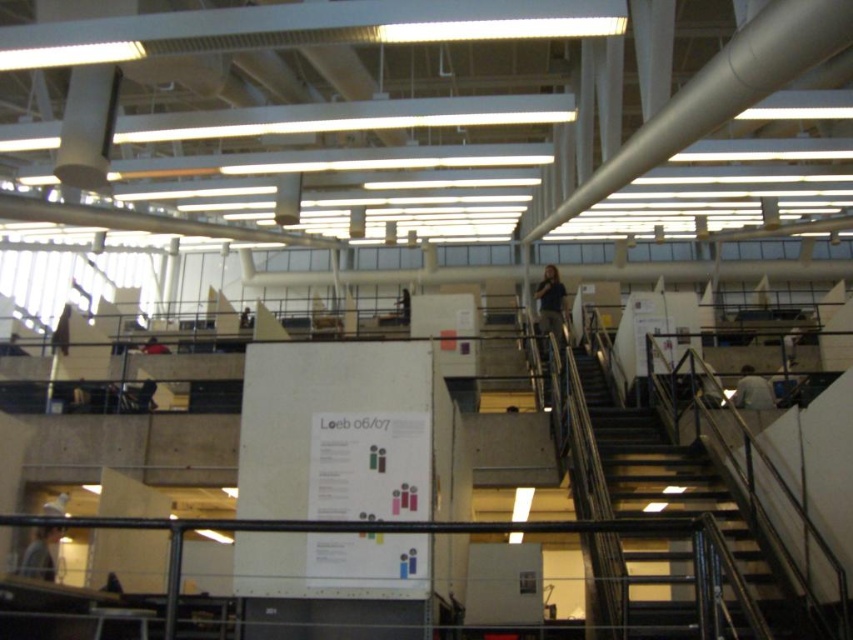
Which is more to the right, dark brown leather jacket at upper center or light brown fabric shirt at lower right?

Positioned to the right is light brown fabric shirt at lower right.

Is point (540, 310) closer to viewer compared to point (735, 385)?

No, (540, 310) is behind (735, 385).

You are a GUI agent. You are given a task and a screenshot of the screen. Output one action in this format:
    pyautogui.click(x=<x>, y=<y>)
    Task: Click on the dark brown leather jacket at upper center
    This screenshot has height=640, width=853.
    Given the screenshot: What is the action you would take?
    pyautogui.click(x=550, y=307)

Does light gray knit hat at lower left appear under dark gray shirt at lower left?

Indeed, light gray knit hat at lower left is positioned under dark gray shirt at lower left.

Between light gray knit hat at lower left and dark gray shirt at lower left, which one is positioned lower?

Positioned lower is light gray knit hat at lower left.

Who is more distant from viewer, (39,528) or (15,339)?

The point (15,339) is more distant.

This screenshot has width=853, height=640. Identify the location of light gray knit hat at lower left. (39, 554).

Is light brown fabric shirt at lower right further to the viewer compared to dark blue shirt at lower left?

That is False.

Identify the location of light brown fabric shirt at lower right. This screenshot has height=640, width=853. (752, 390).

Is point (769, 388) more distant than point (154, 344)?

No.

The height and width of the screenshot is (640, 853). In order to click on light brown fabric shirt at lower right in this screenshot , I will do `click(752, 390)`.